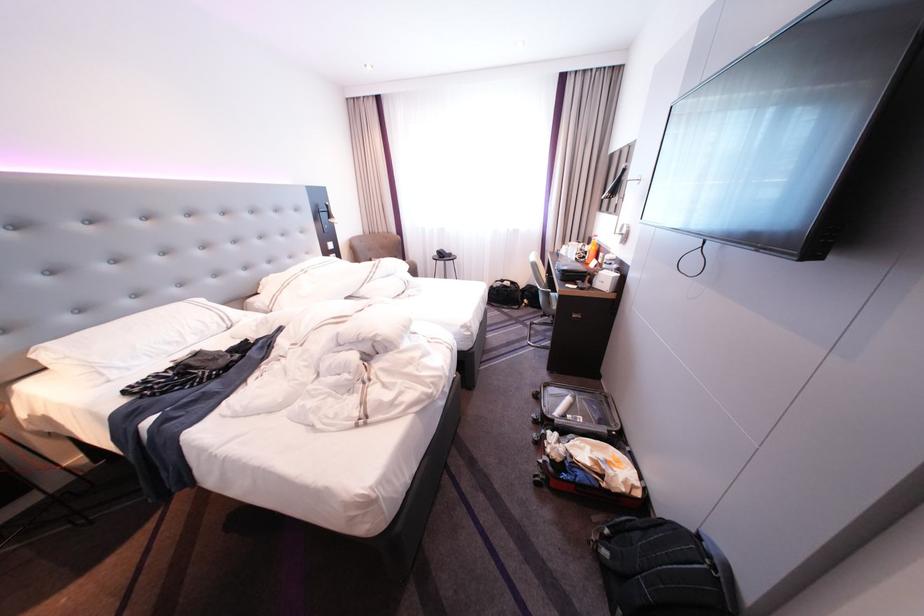
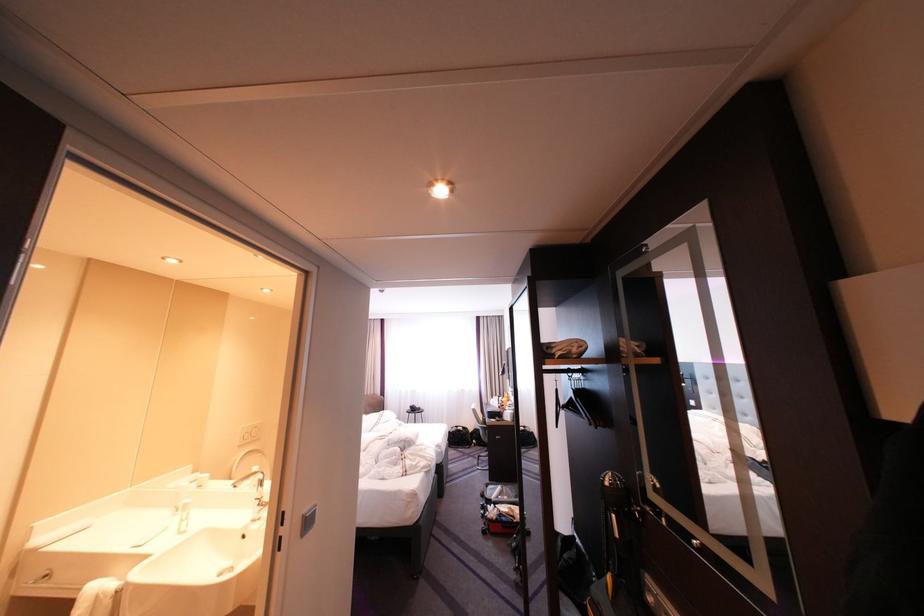
The point at (552, 286) is marked in the first image. Where is the corresponding point in the second image?

(491, 424)